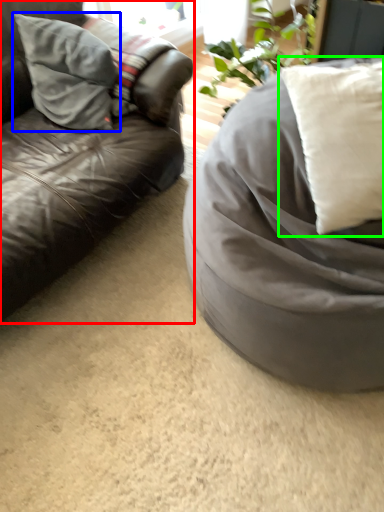
Question: Estimate the real-world distances between objects in this image. Which object is farther from studio couch (highlighted by a red box), pillow (highlighted by a blue box) or pillow (highlighted by a green box)?

Choices:
 (A) pillow
 (B) pillow

Answer: (B)